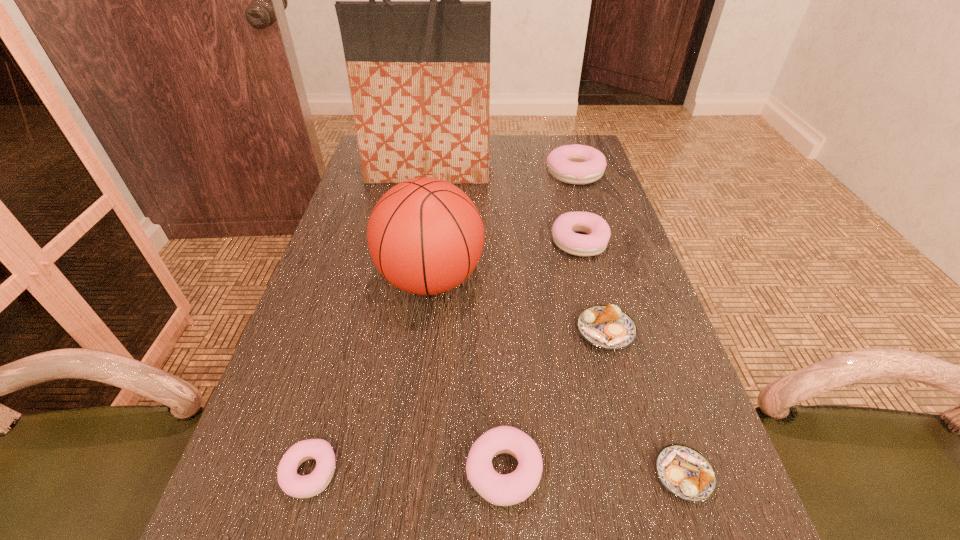
Where is `vacant area that lies between the second farthest pink pastry and the tallest object`? vacant area that lies between the second farthest pink pastry and the tallest object is located at coordinates (504, 207).

The width and height of the screenshot is (960, 540). What are the coordinates of `empty space between the farther brown pastry and the second farthest pink pastry` in the screenshot? It's located at (592, 286).

Image resolution: width=960 pixels, height=540 pixels. Find the location of `object that ranks as the fifth closest to the smallest pink pastry`. object that ranks as the fifth closest to the smallest pink pastry is located at coordinates (563, 231).

Image resolution: width=960 pixels, height=540 pixels. I want to click on the seventh closest object to the basketball, so click(683, 471).

Locate an element on the screen. the third closest pastry to the nearer brown pastry is located at coordinates (563, 231).

This screenshot has width=960, height=540. I want to click on the fifth closest pastry to the tallest pastry, so click(297, 486).

Select which pink pastry appears as the closest to the fifth pastry from right to left. Please provide its 2D coordinates. Your answer should be formatted as a tuple, i.e. [(x, y)], where the tuple contains the x and y coordinates of a point satisfying the conditions above.

[(297, 486)]

The image size is (960, 540). Find the location of `pink pastry that is the closest to the second tallest object`. pink pastry that is the closest to the second tallest object is located at coordinates (563, 231).

Locate an element on the screen. This screenshot has height=540, width=960. vacant space that satisfies the following two spatial constraints: 1. on the front-facing side of the bigger brown pastry; 2. on the right side of the shopping bag is located at coordinates (401, 331).

Identify the location of free space that satisfies the following two spatial constraints: 1. on the front side of the basketball; 2. on the left side of the nearer brown pastry. (408, 475).